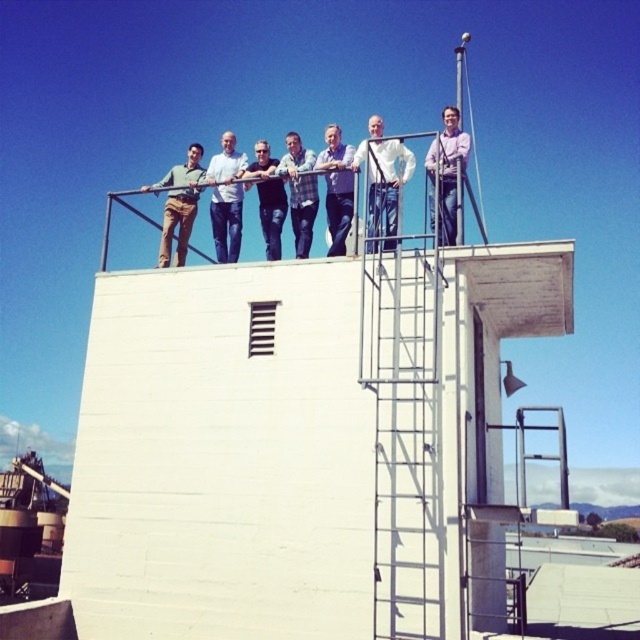
Does light blue jeans at center lie in front of denim jeans at center?

No, light blue jeans at center is behind denim jeans at center.

Is point (225, 236) farther from viewer compared to point (282, 220)?

Yes.

Identify the location of light blue jeans at center. The image size is (640, 640). (227, 198).

Is pink shirt at upper right shorter than matte khaki pants at upper left?

Indeed, pink shirt at upper right has a lesser height compared to matte khaki pants at upper left.

Which is in front, point (433, 160) or point (170, 173)?

Point (433, 160) is in front.

Which is in front, point (440, 243) or point (177, 170)?

Point (440, 243)

Where is `pink shirt at upper right`? This screenshot has width=640, height=640. pink shirt at upper right is located at coordinates (445, 173).

Does light blue jeans at center have a lesser width compared to pink shirt at upper right?

Correct, light blue jeans at center's width is less than pink shirt at upper right's.

Measure the distance from light blue jeans at center to pink shirt at upper right.

The distance of light blue jeans at center from pink shirt at upper right is 3.95 meters.

You are a GUI agent. You are given a task and a screenshot of the screen. Output one action in this format:
    pyautogui.click(x=<x>, y=<y>)
    Task: Click on the light blue jeans at center
    The height and width of the screenshot is (640, 640).
    Given the screenshot: What is the action you would take?
    pyautogui.click(x=227, y=198)

You are a GUI agent. You are given a task and a screenshot of the screen. Output one action in this format:
    pyautogui.click(x=<x>, y=<y>)
    Task: Click on the light blue jeans at center
    This screenshot has height=640, width=640.
    Given the screenshot: What is the action you would take?
    pyautogui.click(x=227, y=198)